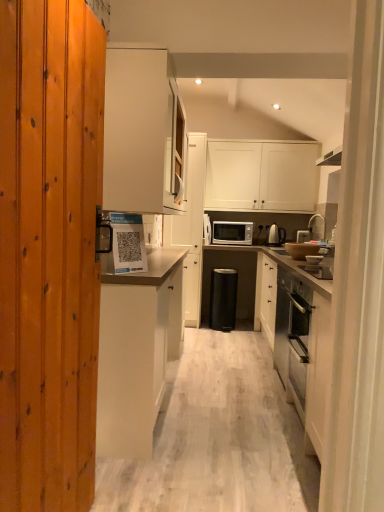
Question: From a real-world perspective, is satin silver toaster at center above or below black plastic trash bin at center?

Choices:
 (A) below
 (B) above

Answer: (B)

Question: Would you say satin silver toaster at center is inside or outside black plastic trash bin at center?

Choices:
 (A) outside
 (B) inside

Answer: (A)

Question: Which is farther from the white glossy microwave oven at center?

Choices:
 (A) matte silver teapot at right
 (B) white matte cabinet at upper center, which appears as the 4th cabinetry when viewed from the left
 (C) white matte cabinet at center, marked as the 1th cabinetry in a left-to-right arrangement
 (D) white matte cabinet at upper center, the 2th cabinetry positioned from the left
 (E) white glossy cabinet at upper center, which is the 3th cabinetry in left-to-right order

Answer: (C)

Question: Estimate the real-world distances between objects in this image. Which object is farther from the white glossy microwave oven at center?

Choices:
 (A) black plastic trash bin at center
 (B) white matte cabinet at center, which is counted as the 4th cabinetry, starting from the right
 (C) white glossy cabinet at upper center, which is the 3th cabinetry in left-to-right order
 (D) silver metallic faucet at upper right
 (E) white matte cabinet at upper center, acting as the 1th cabinetry starting from the right

Answer: (B)